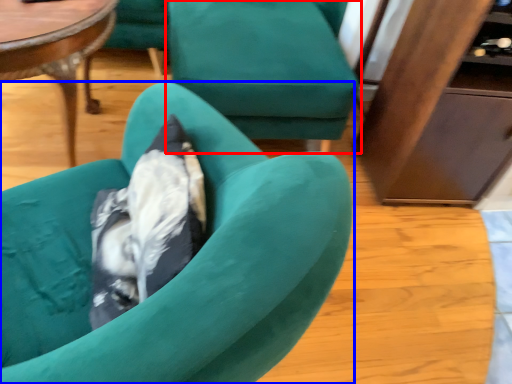
Question: Which object appears closest to the camera in this image, chair (highlighted by a red box) or chair (highlighted by a blue box)?

Choices:
 (A) chair
 (B) chair

Answer: (B)